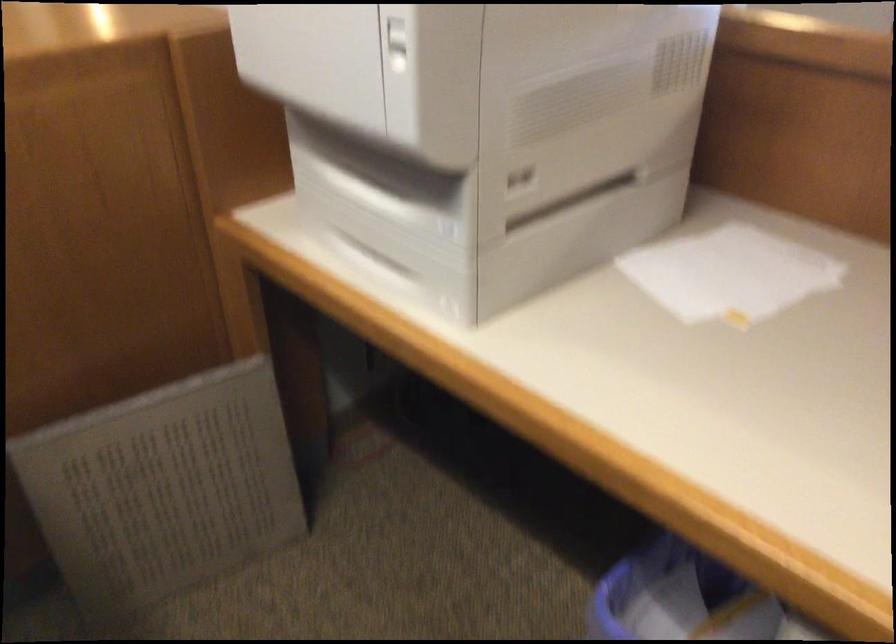
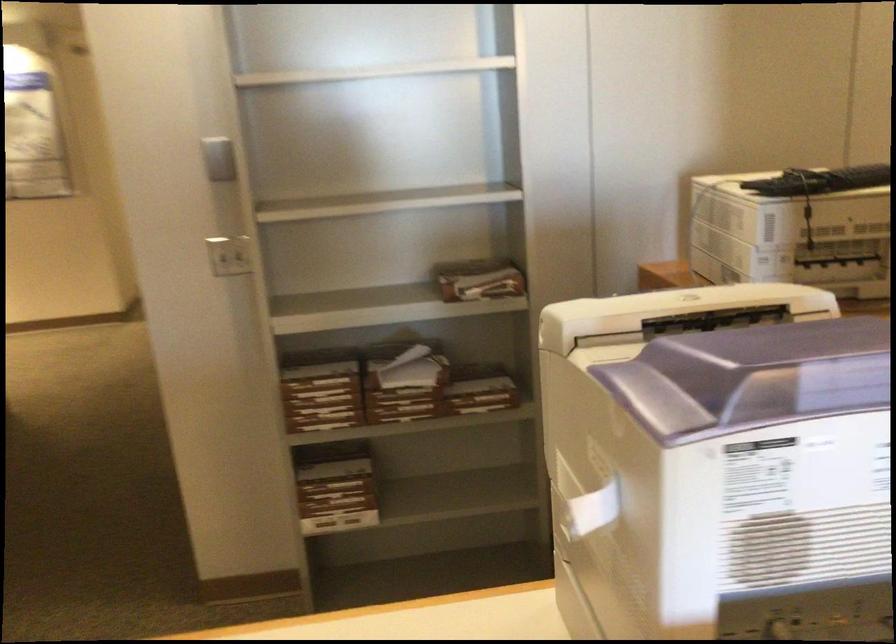
Question: I am providing you with two images of the same scene from different viewpoints. Please identify which objects are invisible in image2.

Choices:
 (A) purple printer lid
 (B) printer paper tray
 (C) white printer handle
 (D) toothbrush holder

Answer: (B)